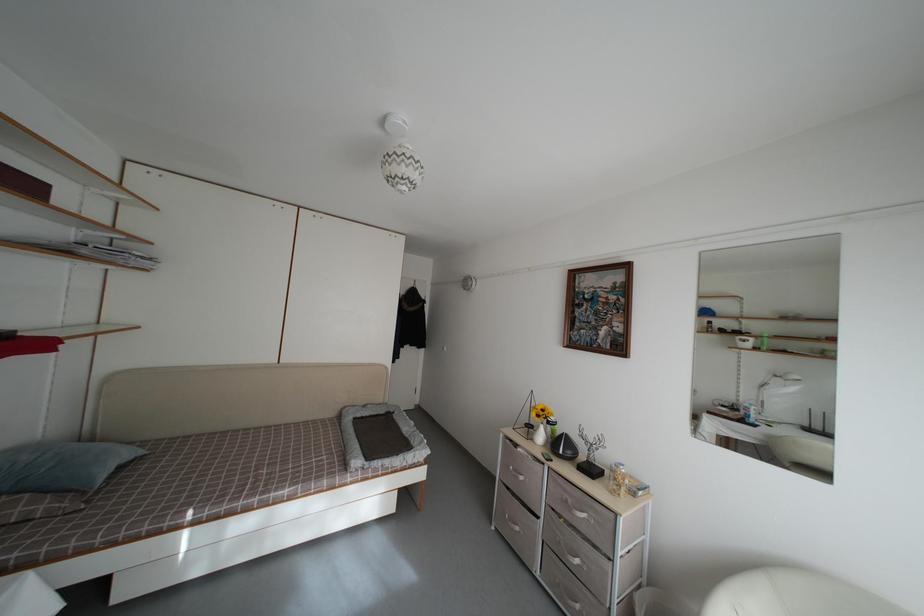
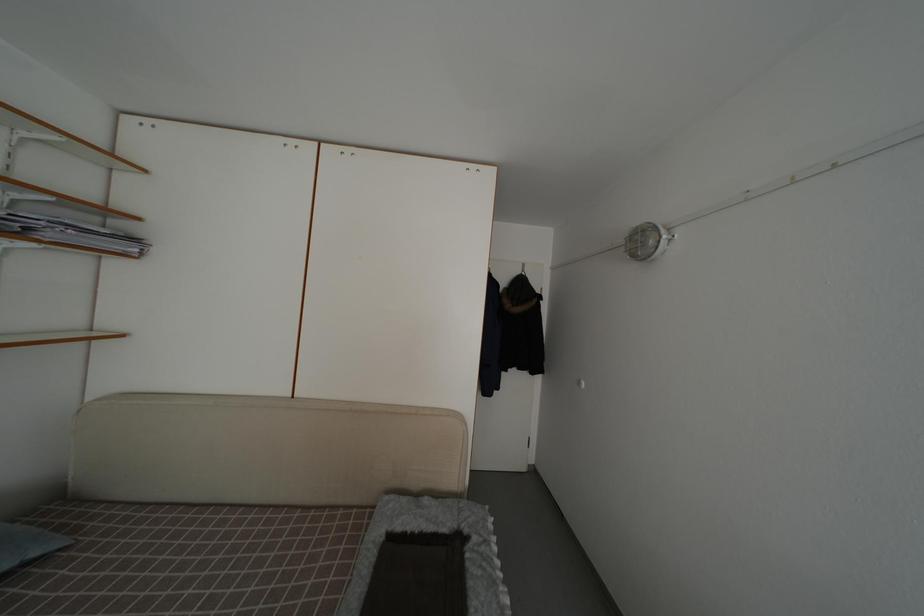
Question: What movement of the cameraman would produce the second image?

Choices:
 (A) Left
 (B) Right
 (C) Forward
 (D) Backward

Answer: (C)